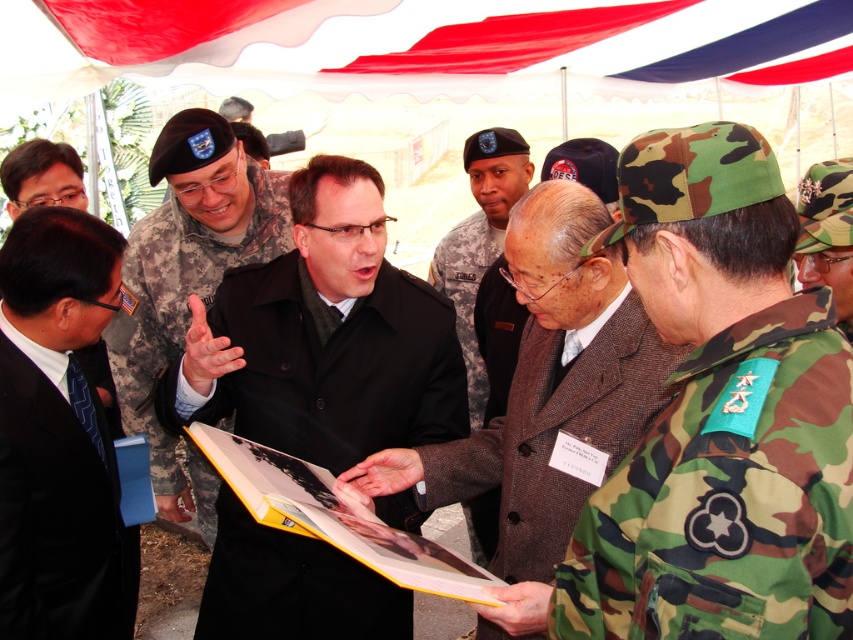
Is point (376, 198) positioned before point (120, 360)?

That is True.

Which is above, black matte jacket at center or camouflage uniform at center?

camouflage uniform at center

Describe the element at coordinates (325, 337) in the screenshot. I see `black matte jacket at center` at that location.

Locate an element on the screen. The width and height of the screenshot is (853, 640). black matte jacket at center is located at coordinates (325, 337).

Who is higher up, brown woolen coat at center or brown wool coat at center?

Positioned higher is brown wool coat at center.

Looking at this image, can you confirm if brown woolen coat at center is smaller than brown wool coat at center?

No.

Does point (502, 589) come farther from viewer compared to point (440, 262)?

No, it is in front of (440, 262).

Identify the location of brown woolen coat at center. (544, 401).

Which is behind, point (502, 346) or point (78, 356)?

Positioned behind is point (502, 346).

Who is more forward, (x=497, y=538) or (x=84, y=204)?

Point (x=497, y=538)

Identify the location of brown wool coat at center. The image size is (853, 640). (485, 269).